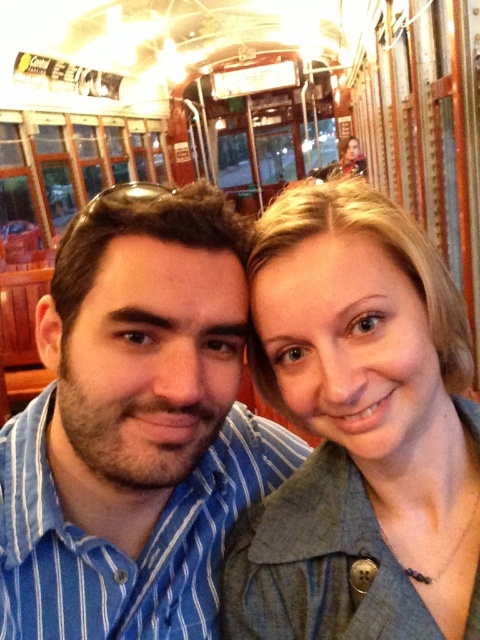
Question: Is the position of blue striped shirt at center more distant than that of green textured jacket at center?

Choices:
 (A) no
 (B) yes

Answer: (B)

Question: Does blue striped shirt at center appear under green textured jacket at center?

Choices:
 (A) yes
 (B) no

Answer: (B)

Question: Where is blue striped shirt at center located in relation to green textured jacket at center in the image?

Choices:
 (A) left
 (B) right

Answer: (A)

Question: Among these points, which one is nearest to the camera?

Choices:
 (A) (182, 212)
 (B) (433, 520)

Answer: (A)

Question: Which of the following is the closest to the observer?

Choices:
 (A) green textured jacket at center
 (B) blue striped shirt at center

Answer: (A)